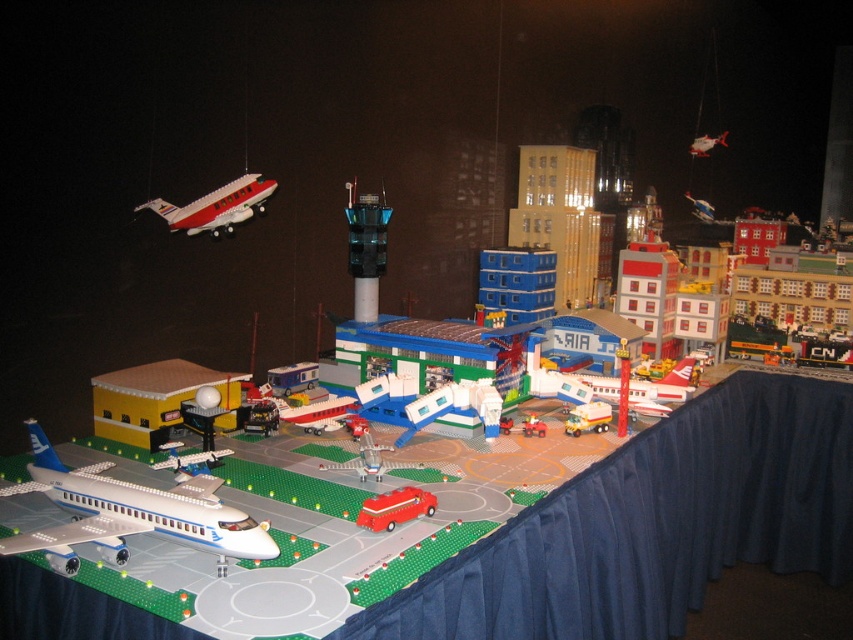
In the scene shown: Which is more to the right, blue fabric tablecloth at lower right or rubber fire truck at center?

From the viewer's perspective, blue fabric tablecloth at lower right appears more on the right side.

What do you see at coordinates (653, 524) in the screenshot? I see `blue fabric tablecloth at lower right` at bounding box center [653, 524].

Between point (639, 518) and point (378, 506), which one is positioned behind?

The point (639, 518) is more distant.

I want to click on blue fabric tablecloth at lower right, so click(653, 524).

Which is below, red glossy airplane at upper left or red plastic car at center?

red plastic car at center is lower down.

Who is taller, red glossy airplane at upper left or red plastic car at center?

red glossy airplane at upper left is taller.

Describe the element at coordinates (216, 205) in the screenshot. I see `red glossy airplane at upper left` at that location.

Where is `red glossy airplane at upper left`? Image resolution: width=853 pixels, height=640 pixels. red glossy airplane at upper left is located at coordinates (216, 205).

Who is positioned more to the left, blue fabric tablecloth at lower right or shiny silver airplane at upper right?

blue fabric tablecloth at lower right is more to the left.

Does blue fabric tablecloth at lower right come in front of shiny silver airplane at upper right?

Yes, blue fabric tablecloth at lower right is in front of shiny silver airplane at upper right.

Who is more forward, (653, 614) or (708, 145)?

Point (653, 614)

This screenshot has width=853, height=640. Find the location of `blue fabric tablecloth at lower right`. blue fabric tablecloth at lower right is located at coordinates (653, 524).